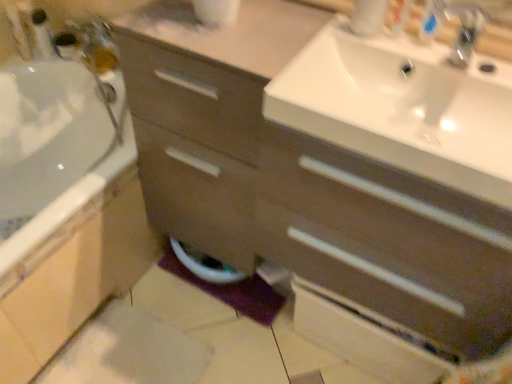
Question: Considering the positions of purple fabric bath mat at lower center and metallic silver faucet at upper right in the image, is purple fabric bath mat at lower center taller or shorter than metallic silver faucet at upper right?

Choices:
 (A) tall
 (B) short

Answer: (B)

Question: In terms of size, does purple fabric bath mat at lower center appear bigger or smaller than metallic silver faucet at upper right?

Choices:
 (A) big
 (B) small

Answer: (A)

Question: Which is nearer to the white glossy toilet bowl at lower center?

Choices:
 (A) metallic silver faucet at upper left, which is the second toiletry in bottom-to-top order
 (B) purple fabric bath mat at lower center
 (C) white glossy sink at upper right
 (D) metallic silver faucet at upper right
 (E) white plastic toothbrush at upper right, the 2th toiletry from the back

Answer: (B)

Question: Based on their relative distances, which object is farther from the purple fabric bath mat at lower center?

Choices:
 (A) metallic silver faucet at upper left, the 2th toiletry in the right-to-left sequence
 (B) white plastic toothbrush at upper right, which is the 1th toiletry in bottom-to-top order
 (C) metallic silver faucet at upper right
 (D) white glossy sink at upper right
 (E) white glossy toilet bowl at lower center

Answer: (A)